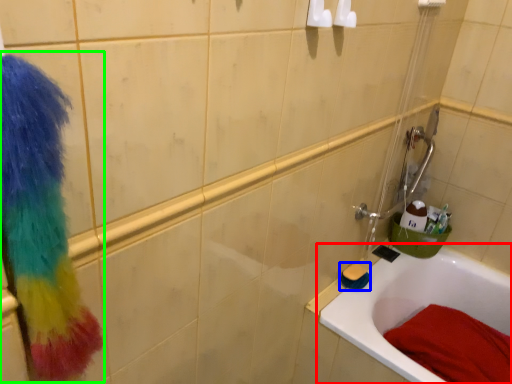
Question: Which object is the closest to the bathtub (highlighted by a red box)? Choose among these: brush (highlighted by a blue box) or scrub (highlighted by a green box).

Choices:
 (A) brush
 (B) scrub

Answer: (A)